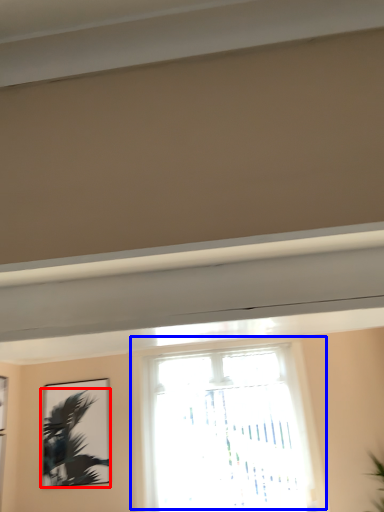
Question: Which point is closer to the camera, palm tree (highlighted by a red box) or window (highlighted by a blue box)?

Choices:
 (A) palm tree
 (B) window

Answer: (B)